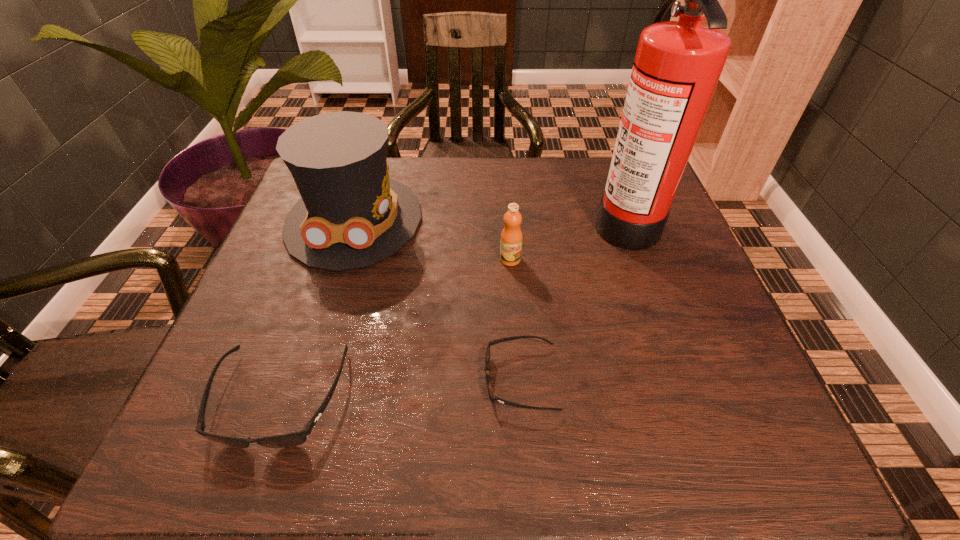
Find the location of a particular element. object that ranks as the fourth closest to the rightmost object is located at coordinates (293, 439).

I want to click on vacant space that satisfies the following two spatial constraints: 1. on the front-facing side of the shortest object; 2. on the front-facing side of the taller sunglasses, so click(522, 399).

You are a GUI agent. You are given a task and a screenshot of the screen. Output one action in this format:
    pyautogui.click(x=<x>, y=<y>)
    Task: Click on the vacant space that satisfies the following two spatial constraints: 1. on the front-facing side of the tallest object; 2. on the front-facing side of the left sunglasses
    The height and width of the screenshot is (540, 960).
    Given the screenshot: What is the action you would take?
    pos(689,399)

Locate an element on the screen. This screenshot has height=540, width=960. free space that satisfies the following two spatial constraints: 1. on the front-facing side of the fire extinguisher; 2. on the front-facing side of the second shortest object is located at coordinates (689, 399).

Where is `blank area in the image that satisfies the following two spatial constraints: 1. on the front-facing side of the fire extinguisher; 2. on the front-facing side of the left sunglasses`? The image size is (960, 540). blank area in the image that satisfies the following two spatial constraints: 1. on the front-facing side of the fire extinguisher; 2. on the front-facing side of the left sunglasses is located at coordinates (689, 399).